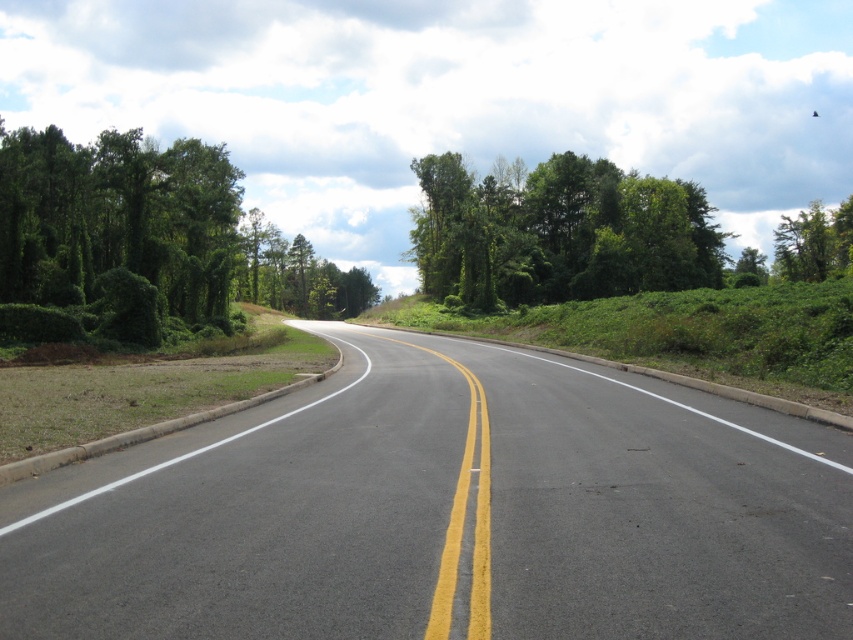
Question: In this image, where is green leafy bush at left located relative to green leafy trees at upper center?

Choices:
 (A) left
 (B) right

Answer: (A)

Question: Which point is closer to the camera?

Choices:
 (A) tap(538, 170)
 (B) tap(115, 243)
 (C) tap(500, 445)

Answer: (C)

Question: Estimate the real-world distances between objects in this image. Which object is closer to the green leafy trees at upper center?

Choices:
 (A) asphalt road at center
 (B) green leafy bush at left

Answer: (B)

Question: Which object appears closest to the camera in this image?

Choices:
 (A) green leafy bush at left
 (B) green leafy trees at upper center
 (C) asphalt road at center

Answer: (C)

Question: Is asphalt road at center to the right of green leafy bush at left from the viewer's perspective?

Choices:
 (A) no
 (B) yes

Answer: (B)

Question: Is green leafy bush at left wider than green leafy trees at upper center?

Choices:
 (A) no
 (B) yes

Answer: (B)